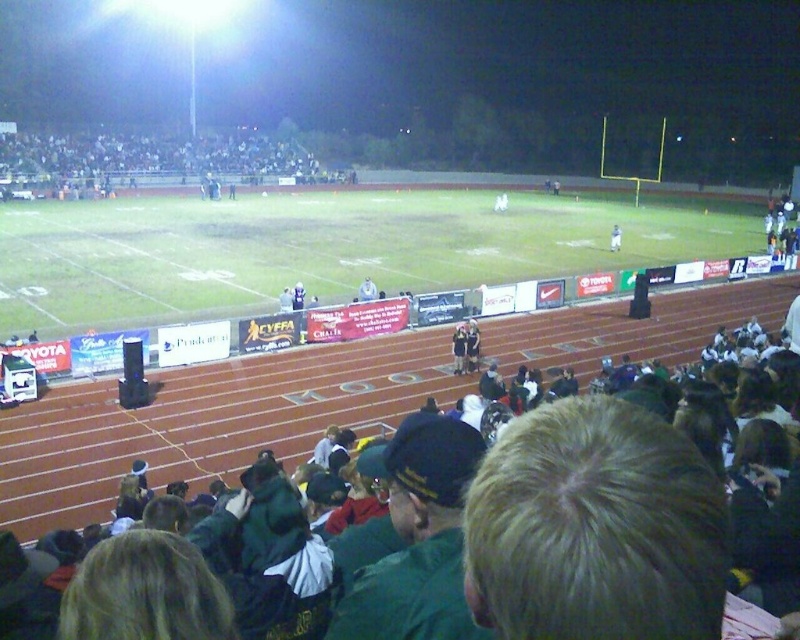
You are a photographer standing at the edge of the football field. You want to take a photo that includes both the blonde hair at lower right and the white plastic bag at center. Which object should you position closer to the left side of your camera frame?

The blonde hair at lower right is to the left of the white plastic bag at center, so to include both in the photo, position the blonde hair at lower right closer to the left side of your camera frame.